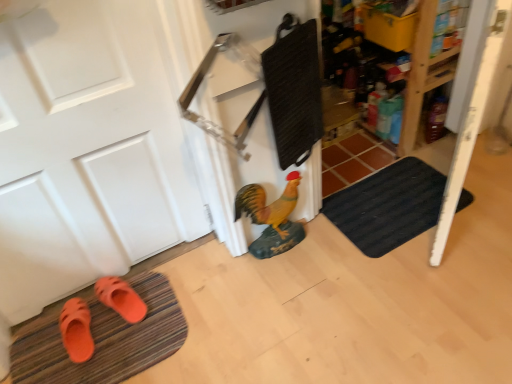
This screenshot has height=384, width=512. Find the location of `empty space that is to the right of orange rubber sandals at lower left, the first footwear viewed from the left`. empty space that is to the right of orange rubber sandals at lower left, the first footwear viewed from the left is located at coordinates (126, 336).